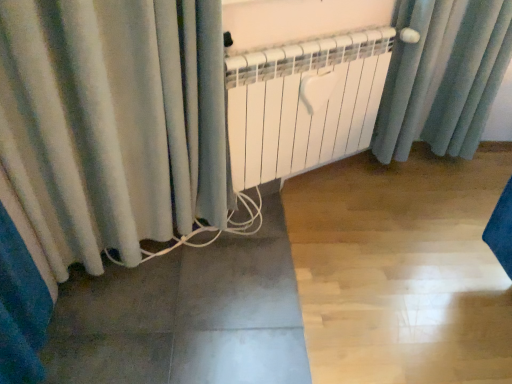
Question: Is velvet curtain at lower left far from white matte radiator at center?

Choices:
 (A) yes
 (B) no

Answer: (B)

Question: Is velvet curtain at lower left directly adjacent to white matte radiator at center?

Choices:
 (A) no
 (B) yes

Answer: (A)

Question: Can you confirm if velvet curtain at lower left is positioned to the left of white matte radiator at center?

Choices:
 (A) no
 (B) yes

Answer: (B)

Question: Considering the relative sizes of velvet curtain at lower left and white matte radiator at center in the image provided, is velvet curtain at lower left shorter than white matte radiator at center?

Choices:
 (A) yes
 (B) no

Answer: (B)

Question: Considering the relative positions of velvet curtain at lower left and white matte radiator at center in the image provided, is velvet curtain at lower left to the right of white matte radiator at center from the viewer's perspective?

Choices:
 (A) no
 (B) yes

Answer: (A)

Question: Is velvet curtain at lower left oriented away from white matte radiator at center?

Choices:
 (A) yes
 (B) no

Answer: (B)

Question: From the image's perspective, would you say white matte radiator at center is positioned over velvet curtain at lower left?

Choices:
 (A) yes
 (B) no

Answer: (A)

Question: Is white matte radiator at center facing away from velvet curtain at lower left?

Choices:
 (A) no
 (B) yes

Answer: (A)

Question: Is white matte radiator at center far away from velvet curtain at lower left?

Choices:
 (A) no
 (B) yes

Answer: (A)

Question: Considering the relative positions of white matte radiator at center and velvet curtain at lower left in the image provided, is white matte radiator at center to the right of velvet curtain at lower left from the viewer's perspective?

Choices:
 (A) yes
 (B) no

Answer: (A)

Question: Does white matte radiator at center have a greater width compared to velvet curtain at lower left?

Choices:
 (A) yes
 (B) no

Answer: (B)

Question: Is white matte radiator at center positioned behind velvet curtain at lower left?

Choices:
 (A) yes
 (B) no

Answer: (A)

Question: Which is correct: velvet curtain at lower left is inside white matte radiator at center, or outside of it?

Choices:
 (A) inside
 (B) outside

Answer: (B)